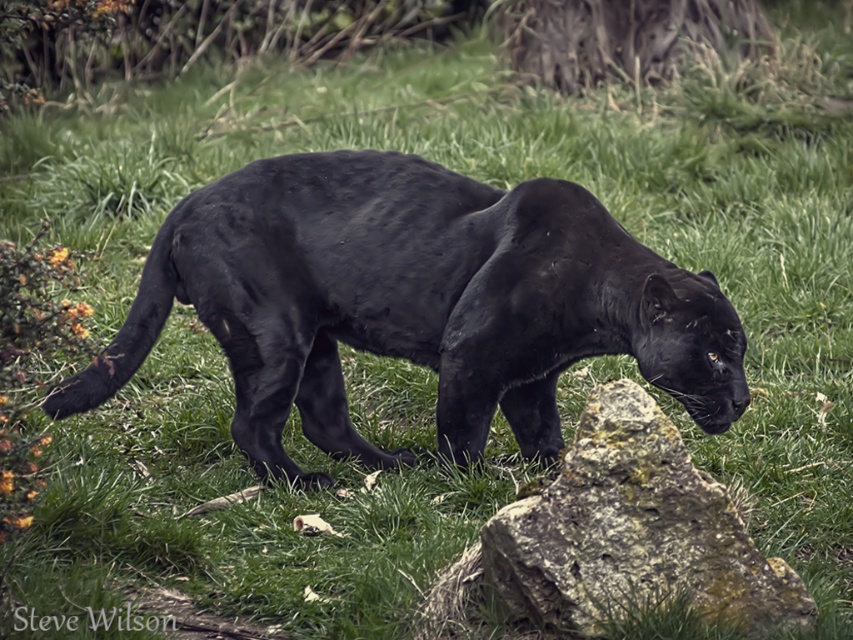
You are a wildlife photographer trying to capture a clear photo of the matte black panther at center. However, the rough stone boulder at center is blocking your view. Can you move the boulder to get a better shot?

The matte black panther at center is positioned over rough stone boulder at center, so you cannot move the boulder without disturbing the panther.

You are a wildlife photographer trying to capture a shot of the matte black panther at center. You notice a rough stone boulder at center in the background. From your current position, will the boulder block your view of the panther?

The rough stone boulder at center is behind the matte black panther at center, so it will not block your view of the panther.